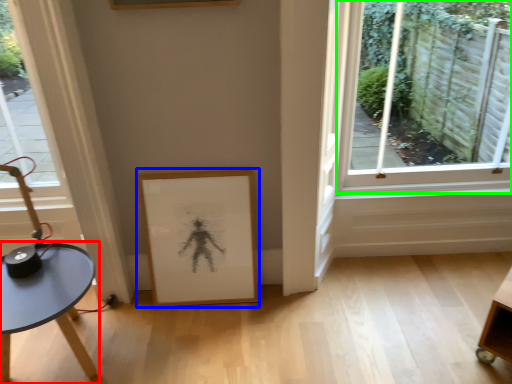
Question: Estimate the real-world distances between objects in this image. Which object is farther from table (highlighted by a red box), picture frame (highlighted by a blue box) or window (highlighted by a green box)?

Choices:
 (A) picture frame
 (B) window

Answer: (B)